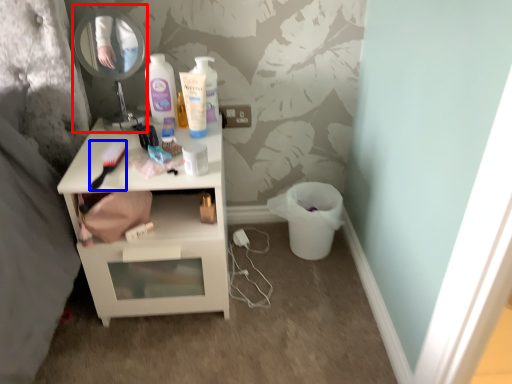
Question: Among these objects, which one is farthest to the camera, mirror (highlighted by a red box) or brush (highlighted by a blue box)?

Choices:
 (A) mirror
 (B) brush

Answer: (A)